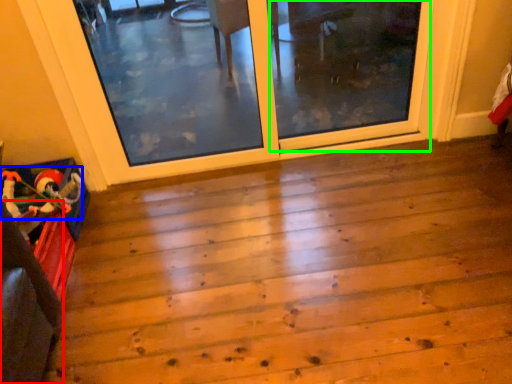
Question: Which object is the closest to the furniture (highlighted by a red box)? Choose among these: toy (highlighted by a blue box) or screen door (highlighted by a green box).

Choices:
 (A) toy
 (B) screen door

Answer: (A)